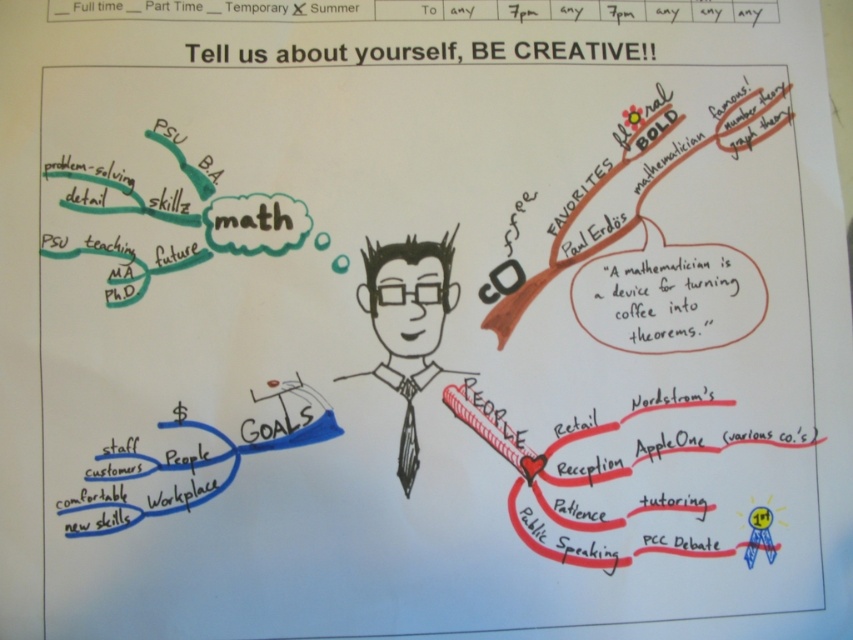
Question: Which of the following is the farthest from the observer?

Choices:
 (A) (416, 371)
 (B) (404, 465)

Answer: (A)

Question: Among these objects, which one is farthest from the camera?

Choices:
 (A) black silk tie at center
 (B) black ink drawing of man at center

Answer: (B)

Question: Considering the relative positions of black ink drawing of man at center and black silk tie at center in the image provided, where is black ink drawing of man at center located with respect to black silk tie at center?

Choices:
 (A) above
 (B) below

Answer: (A)

Question: Can you confirm if black ink drawing of man at center is smaller than black silk tie at center?

Choices:
 (A) no
 (B) yes

Answer: (A)

Question: Can you confirm if black ink drawing of man at center is positioned to the left of black silk tie at center?

Choices:
 (A) yes
 (B) no

Answer: (A)